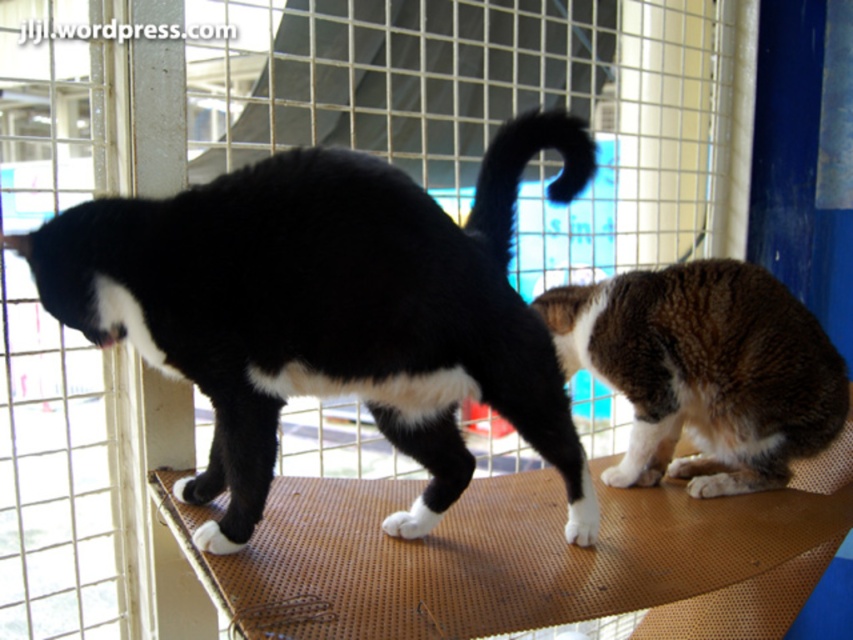
Question: Which is farther from the black matte tail at center?

Choices:
 (A) black fur cat at left
 (B) brown shaggy cat at right

Answer: (B)

Question: Can you confirm if black fur cat at left is positioned to the right of brown shaggy cat at right?

Choices:
 (A) yes
 (B) no

Answer: (B)

Question: Does brown shaggy cat at right lie in front of black matte tail at center?

Choices:
 (A) yes
 (B) no

Answer: (B)

Question: Does black fur cat at left appear on the left side of black matte tail at center?

Choices:
 (A) no
 (B) yes

Answer: (B)

Question: Which object is farther from the camera taking this photo?

Choices:
 (A) black matte tail at center
 (B) brown shaggy cat at right
 (C) black fur cat at left

Answer: (B)

Question: Which object is the closest to the black matte tail at center?

Choices:
 (A) brown shaggy cat at right
 (B) black fur cat at left

Answer: (B)